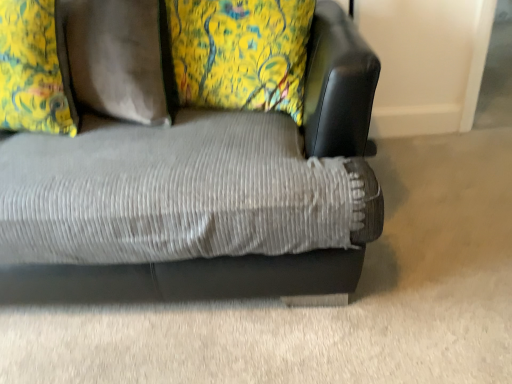
What do you see at coordinates (34, 69) in the screenshot? I see `floral fabric pillow at upper left` at bounding box center [34, 69].

Based on the photo, what is the approximate width of floral fabric pillow at upper left?

floral fabric pillow at upper left is 22.68 centimeters in width.

In order to face corduroy fabric couch at center, should I rotate leftwards or rightwards?

You should rotate left by 18.251 degrees.

Describe the element at coordinates (337, 85) in the screenshot. I see `black leather swivel chair at upper right` at that location.

Where is `floral fabric pillow at upper left`? The height and width of the screenshot is (384, 512). floral fabric pillow at upper left is located at coordinates (34, 69).

From a real-world perspective, is black leather swivel chair at upper right under floral fabric pillow at upper left?

Indeed, from a real-world perspective, black leather swivel chair at upper right is positioned beneath floral fabric pillow at upper left.

From the picture: Between black leather swivel chair at upper right and floral fabric pillow at upper left, which one is positioned in front?

floral fabric pillow at upper left is in front.

Is there a large distance between black leather swivel chair at upper right and floral fabric pillow at upper left?

That's not correct — black leather swivel chair at upper right is a little close to floral fabric pillow at upper left.

From the image's perspective, is black leather swivel chair at upper right above corduroy fabric couch at center?

Correct, black leather swivel chair at upper right appears higher than corduroy fabric couch at center in the image.

How much distance is there between black leather swivel chair at upper right and corduroy fabric couch at center?

8.05 inches.

Would you say corduroy fabric couch at center is part of black leather swivel chair at upper right's contents?

Definitely not — corduroy fabric couch at center is not inside black leather swivel chair at upper right.

From the image's perspective, does corduroy fabric couch at center appear lower than floral fabric pillow at upper left?

→ Yes, from the image's perspective, corduroy fabric couch at center is beneath floral fabric pillow at upper left.

Is point (342, 285) positioned after point (55, 122)?

No, it is not.

Find the location of `studio couch directly beneath the floral fabric pillow at upper left (from a real-world perspective)`. studio couch directly beneath the floral fabric pillow at upper left (from a real-world perspective) is located at coordinates (202, 276).

Would you say corduroy fabric couch at center is outside black leather swivel chair at upper right?

corduroy fabric couch at center lies outside black leather swivel chair at upper right's area.

How different are the orientations of corduroy fabric couch at center and black leather swivel chair at upper right in degrees?

The angular difference between corduroy fabric couch at center and black leather swivel chair at upper right is 0.649 degrees.

Which is behind, corduroy fabric couch at center or black leather swivel chair at upper right?

black leather swivel chair at upper right is more distant.

From a real-world perspective, which object rests below the other?

From a 3D spatial view, corduroy fabric couch at center is below.

Who is smaller, floral fabric pillow at upper left or black leather swivel chair at upper right?

With smaller size is black leather swivel chair at upper right.

From the picture: Between floral fabric pillow at upper left and black leather swivel chair at upper right, which one has more height?

black leather swivel chair at upper right is taller.

Could you tell me if floral fabric pillow at upper left is turned towards black leather swivel chair at upper right?

No, floral fabric pillow at upper left is not oriented towards black leather swivel chair at upper right.

From a real-world perspective, is floral fabric pillow at upper left physically below black leather swivel chair at upper right?

No, from a real-world perspective, floral fabric pillow at upper left is not under black leather swivel chair at upper right.

Which is behind, point (66, 90) or point (135, 276)?

The point (66, 90) is behind.

Is floral fabric pillow at upper left wider than corduroy fabric couch at center?

No, floral fabric pillow at upper left is not wider than corduroy fabric couch at center.

Is corduroy fabric couch at center completely or partially inside floral fabric pillow at upper left?

No, corduroy fabric couch at center is located outside of floral fabric pillow at upper left.

Considering the relative sizes of floral fabric pillow at upper left and corduroy fabric couch at center in the image provided, is floral fabric pillow at upper left smaller than corduroy fabric couch at center?

Yes, floral fabric pillow at upper left is smaller than corduroy fabric couch at center.

Image resolution: width=512 pixels, height=384 pixels. Identify the location of swivel chair on the right of the floral fabric pillow at upper left. (337, 85).

Where is `studio couch located underneath the black leather swivel chair at upper right (from a real-world perspective)`? studio couch located underneath the black leather swivel chair at upper right (from a real-world perspective) is located at coordinates (202, 276).

From the image, which object appears to be nearer to floral fabric pillow at upper left, corduroy fabric couch at center or black leather swivel chair at upper right?

corduroy fabric couch at center is closer to floral fabric pillow at upper left.

From the image, which object appears to be farther from black leather swivel chair at upper right, floral fabric pillow at upper left or corduroy fabric couch at center?

Based on the image, floral fabric pillow at upper left appears to be further to black leather swivel chair at upper right.

Looking at this image, from the image, which object appears to be nearer to floral fabric pillow at upper left, black leather swivel chair at upper right or corduroy fabric couch at center?

Among the two, corduroy fabric couch at center is located nearer to floral fabric pillow at upper left.

Consider the image. Estimate the real-world distances between objects in this image. Which object is further from corduroy fabric couch at center, floral fabric pillow at upper left or black leather swivel chair at upper right?

The object further to corduroy fabric couch at center is floral fabric pillow at upper left.

Estimate the real-world distances between objects in this image. Which object is closer to corduroy fabric couch at center, black leather swivel chair at upper right or floral fabric pillow at upper left?

Based on the image, black leather swivel chair at upper right appears to be nearer to corduroy fabric couch at center.

From the image, which object appears to be farther from black leather swivel chair at upper right, corduroy fabric couch at center or floral fabric pillow at upper left?

floral fabric pillow at upper left is positioned further to the anchor black leather swivel chair at upper right.

Identify the location of studio couch located between floral fabric pillow at upper left and black leather swivel chair at upper right in the left-right direction. (202, 276).